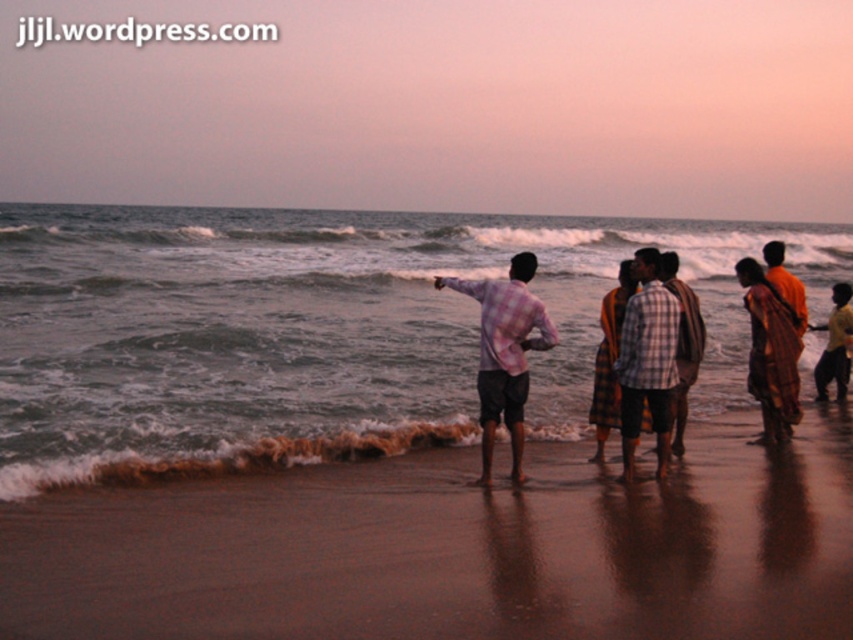
Question: From the image, what is the correct spatial relationship of greenish-blue water at center in relation to checkered fabric shirt at center?

Choices:
 (A) below
 (B) above

Answer: (B)

Question: Which object is positioned closest to the checkered fabric shirt at center?

Choices:
 (A) yellow cotton shirt at right
 (B) brown sand at lower center
 (C) pink checkered shirt at center
 (D) greenish-blue water at center

Answer: (C)

Question: Is greenish-blue water at center to the left of brown sand at lower center from the viewer's perspective?

Choices:
 (A) no
 (B) yes

Answer: (B)

Question: Which object is farther from the camera taking this photo?

Choices:
 (A) pink checkered shirt at center
 (B) brown sand at lower center
 (C) greenish-blue water at center
 (D) yellow cotton shirt at right

Answer: (D)

Question: Which object is the closest to the yellow cotton shirt at right?

Choices:
 (A) greenish-blue water at center
 (B) pink checkered shirt at center
 (C) brown sand at lower center

Answer: (B)

Question: Does brown sand at lower center lie behind yellow cotton shirt at right?

Choices:
 (A) yes
 (B) no

Answer: (B)